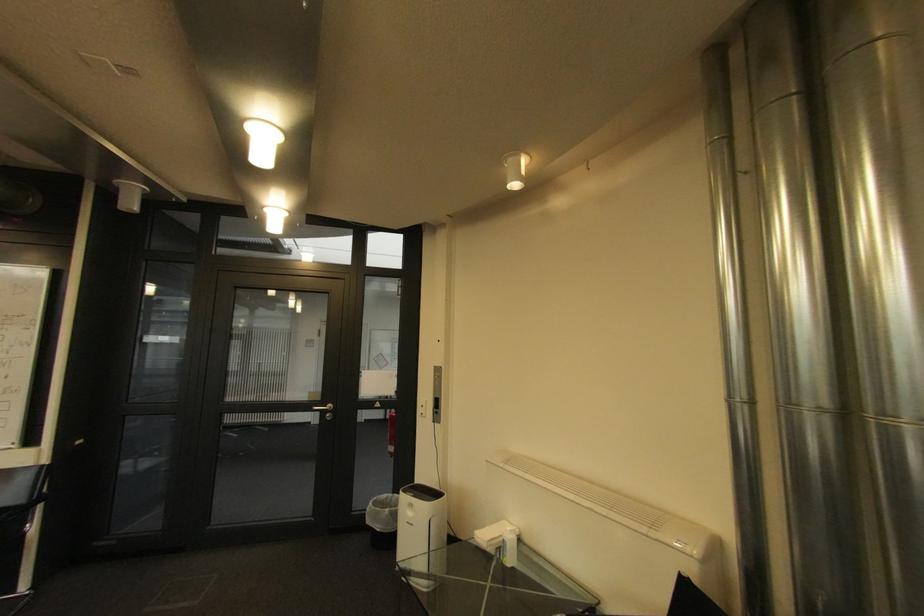
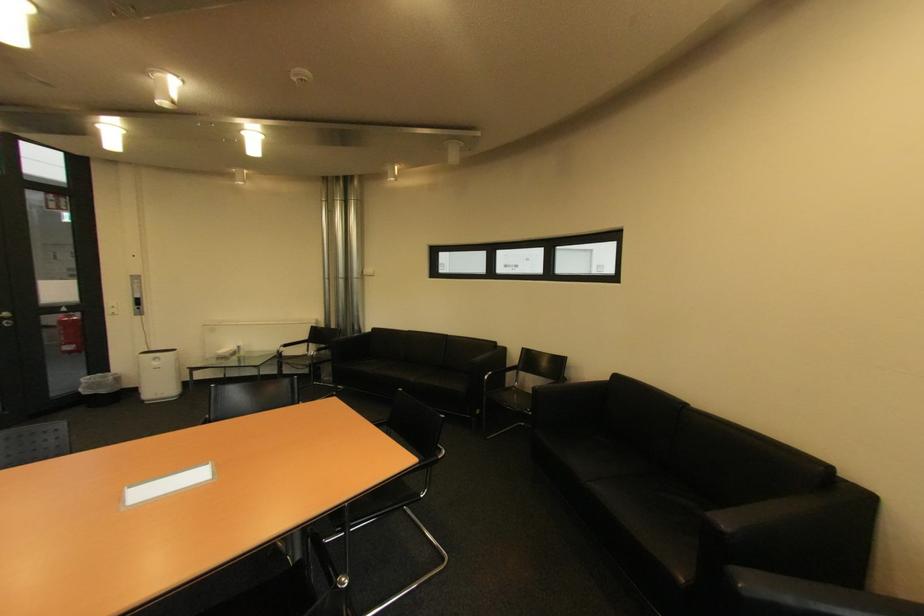
The point at (337, 407) is marked in the first image. Where is the corresponding point in the second image?

(14, 315)